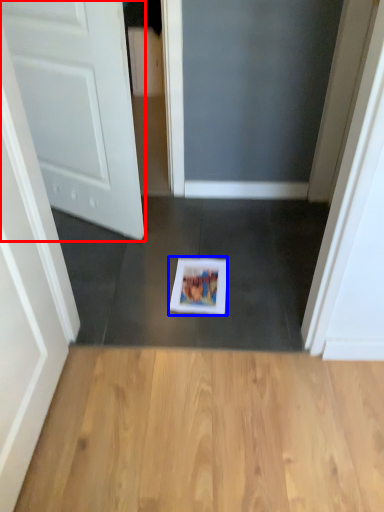
Question: Which point is further to the camera, door (highlighted by a red box) or copy (highlighted by a blue box)?

Choices:
 (A) door
 (B) copy

Answer: (B)